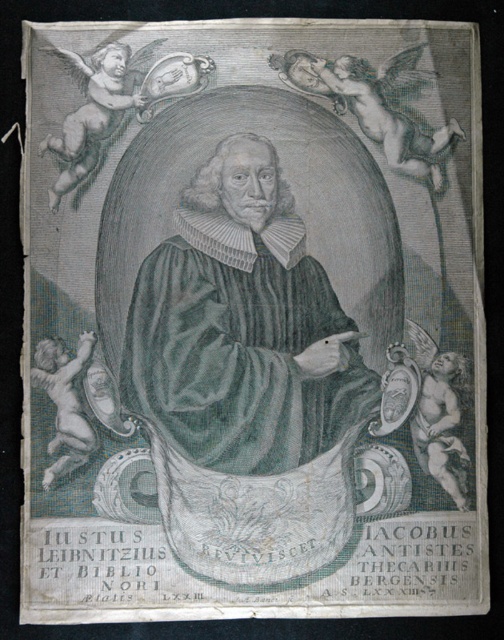
In the scene shown: What are the coordinates of the green striped robe at center in the engraving?

The green striped robe at center is located at coordinates point (241,326).